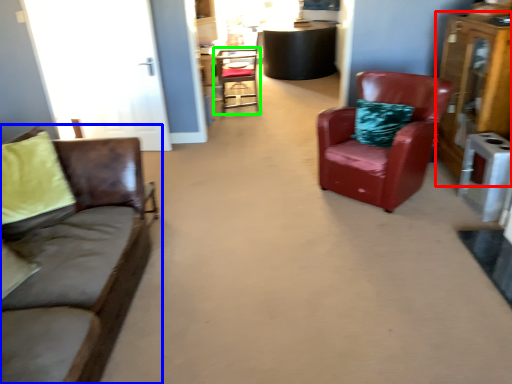
Question: Which object is positioned farthest from dresser (highlighted by a red box)? Select from studio couch (highlighted by a blue box) and chair (highlighted by a green box).

Choices:
 (A) studio couch
 (B) chair

Answer: (B)